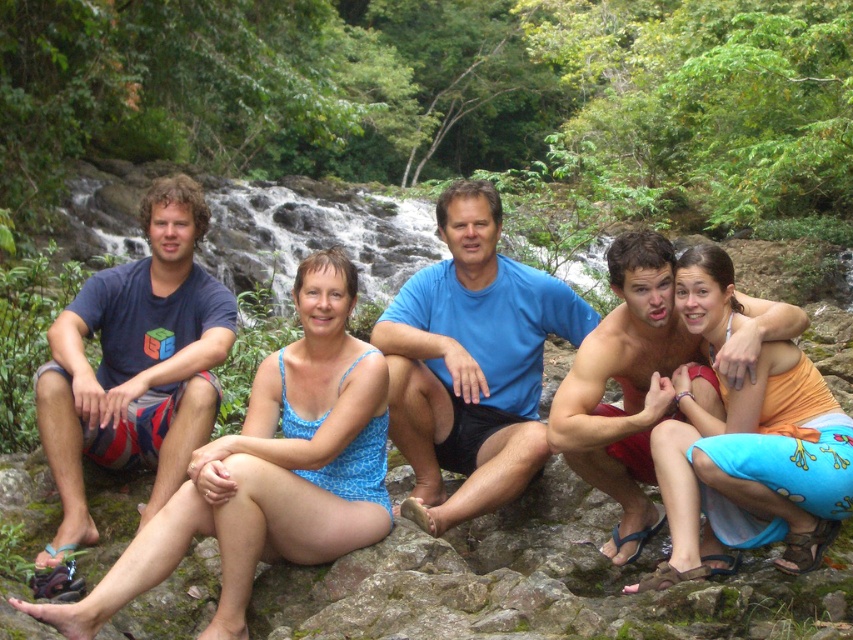
In the scene shown: Who is taller, blue printed swimsuit at center or dark blue t-shirt at left?

With more height is dark blue t-shirt at left.

Is the position of blue printed swimsuit at center less distant than that of dark blue t-shirt at left?

Yes, blue printed swimsuit at center is in front of dark blue t-shirt at left.

Where is `blue printed swimsuit at center`? This screenshot has height=640, width=853. blue printed swimsuit at center is located at coordinates (271, 468).

The width and height of the screenshot is (853, 640). I want to click on blue printed swimsuit at center, so click(x=271, y=468).

Does blue printed swimsuit at center come in front of blue t-shirt at center?

Yes, it is in front of blue t-shirt at center.

Is point (244, 435) farther from camera compared to point (444, 230)?

No.

The width and height of the screenshot is (853, 640). I want to click on blue printed swimsuit at center, so click(271, 468).

Which of these two, blue fabric swimsuit at center or orange cotton dress at center, stands shorter?

With less height is blue fabric swimsuit at center.

Does point (202, 632) come in front of point (740, 529)?

Yes.

Between point (193, 588) and point (706, 451), which one is positioned behind?

Positioned behind is point (193, 588).

The width and height of the screenshot is (853, 640). I want to click on blue fabric swimsuit at center, so click(398, 561).